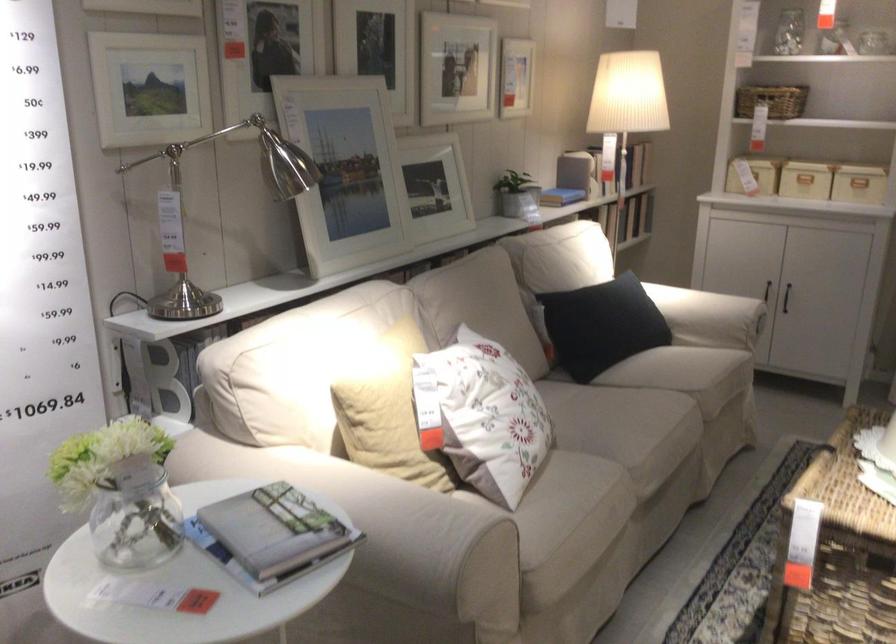
Where would you lift the patterned sofa pillow? Please return your answer as a coordinate pair (x, y).

(484, 415)